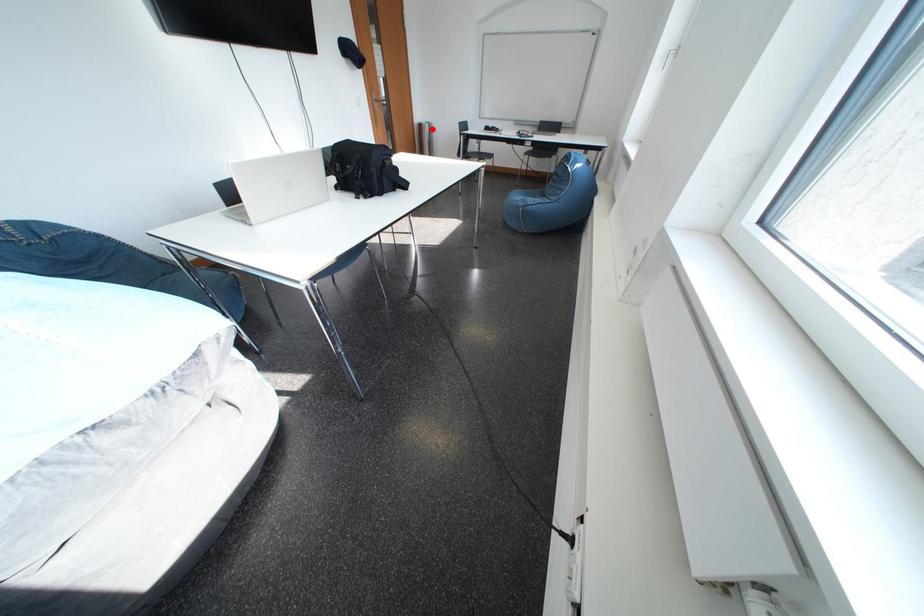
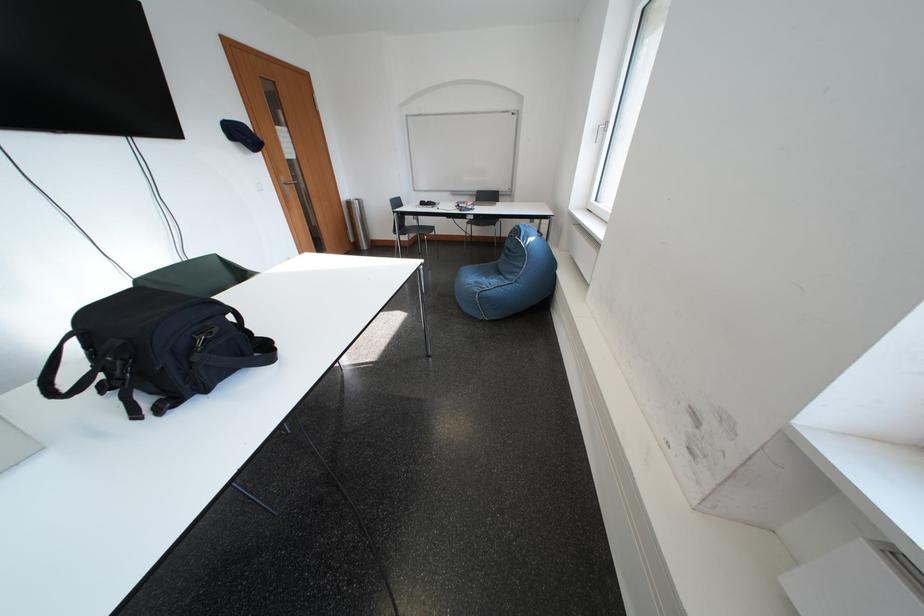
Question: I am providing you with two images of the same scene from different viewpoints. In image1, a red point is highlighted. Considering the same 3D point in image2, which of the following is correct?

Choices:
 (A) It is closer
 (B) It is farther

Answer: (A)